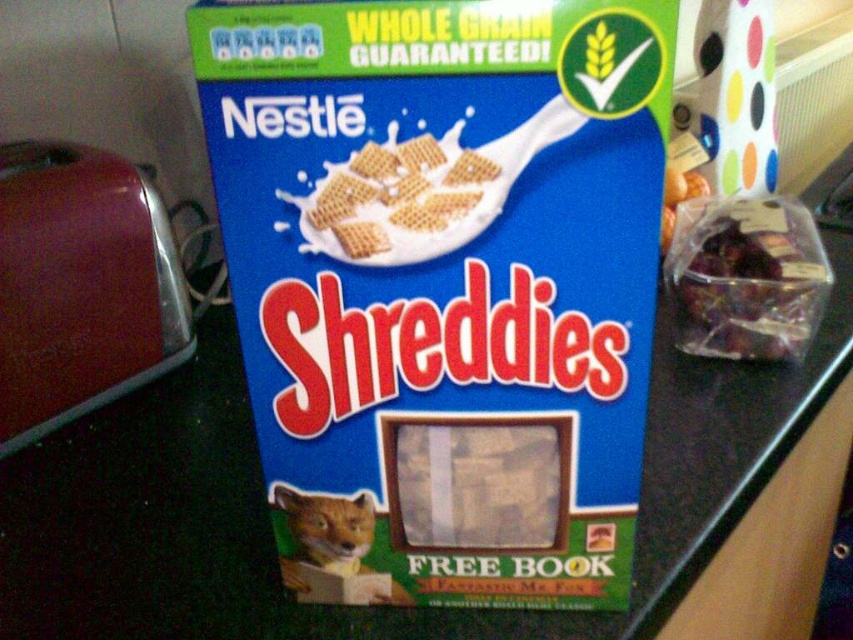
Question: Which point appears closest to the camera in this image?

Choices:
 (A) (602, 577)
 (B) (347, 180)
 (C) (314, 529)

Answer: (B)

Question: In this image, where is blue cardboard box at center located relative to orange fur cat at lower left?

Choices:
 (A) above
 (B) below

Answer: (A)

Question: Which object is farther from the camera taking this photo?

Choices:
 (A) blue cardboard box at center
 (B) orange fur cat at lower left

Answer: (B)

Question: Can you confirm if blue cardboard box at center is positioned above orange fur cat at lower left?

Choices:
 (A) no
 (B) yes

Answer: (B)

Question: Does blue cardboard box at center appear on the right side of clear plastic bag of dried fruit at right?

Choices:
 (A) no
 (B) yes

Answer: (A)

Question: Which point is farther to the camera?

Choices:
 (A) blue cardboard box at center
 (B) baked wheat cereal at center

Answer: (B)